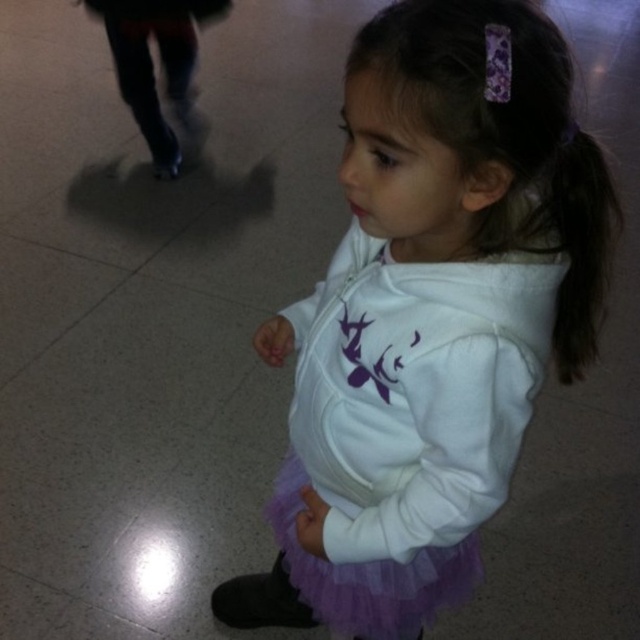
You are standing in the same room as the child. You see two points marked on the floor at coordinates point (531, 392) and point (445, 582). If you were to walk directly towards the child, which point would you encounter first?

Point (531, 392) is in front of point (445, 582), so you would encounter point (531, 392) first when walking towards the child.

The scene shows a child wearing two purple skirts. The purple tulle skirt at center and the purple tulle ballet skirt at center. Which one is positioned higher on the child?

The purple tulle skirt at center is located above the purple tulle ballet skirt at center, so it is positioned higher on the child.